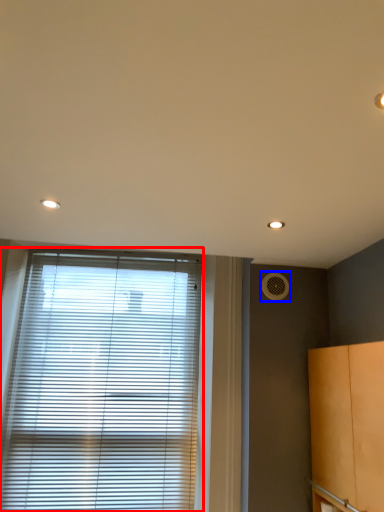
Question: Which point is further to the camera, window blind (highlighted by a red box) or air conditioning (highlighted by a blue box)?

Choices:
 (A) window blind
 (B) air conditioning

Answer: (B)